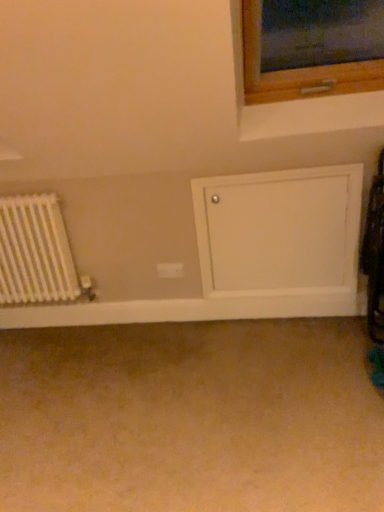
Question: Can you confirm if white painted wood door at lower right is taller than white plastic electric outlet at center?

Choices:
 (A) no
 (B) yes

Answer: (B)

Question: Considering the relative positions of white painted wood door at lower right and white plastic electric outlet at center in the image provided, is white painted wood door at lower right to the left of white plastic electric outlet at center from the viewer's perspective?

Choices:
 (A) yes
 (B) no

Answer: (B)

Question: Is white painted wood door at lower right positioned before white plastic electric outlet at center?

Choices:
 (A) no
 (B) yes

Answer: (B)

Question: Is white painted wood door at lower right aimed at white plastic electric outlet at center?

Choices:
 (A) yes
 (B) no

Answer: (B)

Question: Considering the relative sizes of white painted wood door at lower right and white plastic electric outlet at center in the image provided, is white painted wood door at lower right smaller than white plastic electric outlet at center?

Choices:
 (A) no
 (B) yes

Answer: (A)

Question: From the image's perspective, does white painted wood door at lower right appear lower than white plastic electric outlet at center?

Choices:
 (A) no
 (B) yes

Answer: (A)

Question: Is white matte radiator at left looking in the opposite direction of white painted wood door at lower right?

Choices:
 (A) yes
 (B) no

Answer: (B)

Question: Is white matte radiator at left shorter than white painted wood door at lower right?

Choices:
 (A) yes
 (B) no

Answer: (A)

Question: From the image's perspective, is white matte radiator at left on white painted wood door at lower right?

Choices:
 (A) yes
 (B) no

Answer: (B)

Question: Is white matte radiator at left taller than white painted wood door at lower right?

Choices:
 (A) yes
 (B) no

Answer: (B)

Question: Are white matte radiator at left and white painted wood door at lower right located far from each other?

Choices:
 (A) no
 (B) yes

Answer: (B)

Question: Is white matte radiator at left located outside white painted wood door at lower right?

Choices:
 (A) yes
 (B) no

Answer: (A)

Question: Is the depth of white matte radiator at left less than that of beige carpet at lower center?

Choices:
 (A) no
 (B) yes

Answer: (A)